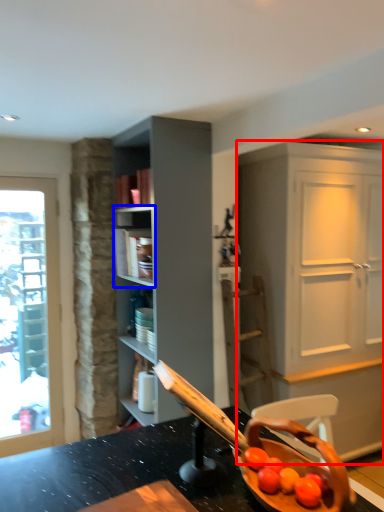
Question: Which object is closer to the camera taking this photo, cabinetry (highlighted by a red box) or shelf (highlighted by a blue box)?

Choices:
 (A) cabinetry
 (B) shelf

Answer: (A)